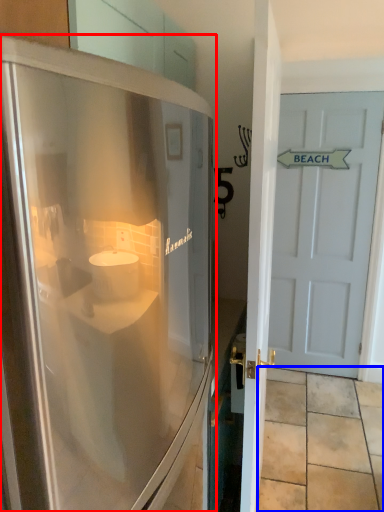
Question: Which point is closer to the camera, refrigerator (highlighted by a red box) or tile (highlighted by a blue box)?

Choices:
 (A) refrigerator
 (B) tile

Answer: (A)